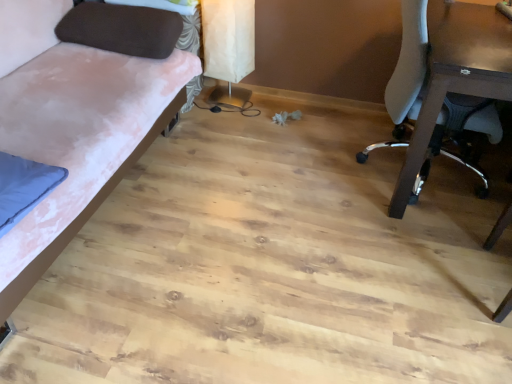
The width and height of the screenshot is (512, 384). Find the location of `free space to the right of white paper lampshade at upper center`. free space to the right of white paper lampshade at upper center is located at coordinates (264, 108).